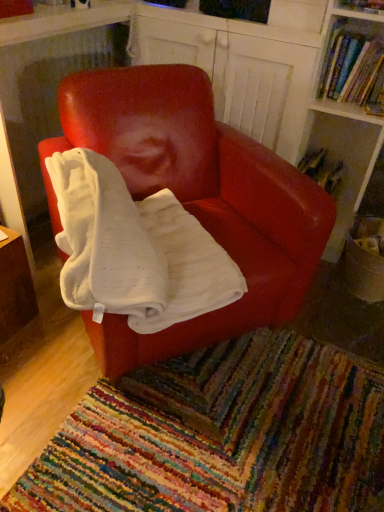
Question: Visually, is hardcover book at upper right, acting as the 1th book starting from the top, positioned to the left or to the right of multicolored woven mat at lower center?

Choices:
 (A) right
 (B) left

Answer: (A)

Question: From the image's perspective, is hardcover book at upper right, acting as the 1th book starting from the top, located above or below multicolored woven mat at lower center?

Choices:
 (A) below
 (B) above

Answer: (B)

Question: Estimate the real-world distances between objects in this image. Which object is closer to the hardcover book at upper right, the 1th book in the back-to-front sequence?

Choices:
 (A) multicolored woven mat at lower center
 (B) matte red chair at center
 (C) hardcover book at upper right, acting as the second book starting from the back

Answer: (C)

Question: Which of these objects is positioned closest to the matte red chair at center?

Choices:
 (A) multicolored woven mat at lower center
 (B) hardcover book at upper right, the 1th book in the back-to-front sequence
 (C) hardcover book at upper right, which is counted as the second book, starting from the bottom

Answer: (A)